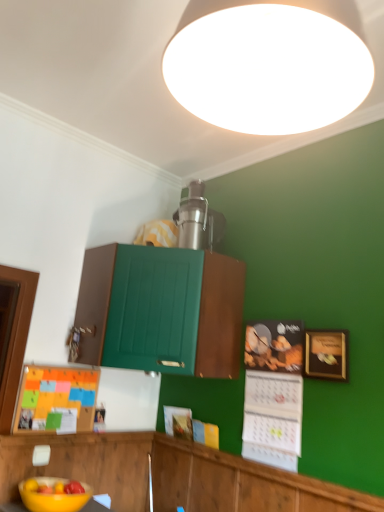
Question: Visually, is white matte ceiling light at upper center positioned to the left or to the right of yellow matte bowl at lower left?

Choices:
 (A) left
 (B) right

Answer: (B)

Question: Considering the positions of white matte ceiling light at upper center and yellow matte bowl at lower left in the image, is white matte ceiling light at upper center taller or shorter than yellow matte bowl at lower left?

Choices:
 (A) tall
 (B) short

Answer: (A)

Question: Which object is positioned farthest from the green matte cabinet at center, placed as the 2th cabinetry when sorted from bottom to top?

Choices:
 (A) matte black calendar at lower right, acting as the 1th bulletin board starting from the right
 (B) yellow matte bowl at lower left
 (C) burlap bulletin board at lower left, the 2th bulletin board positioned from the right
 (D) gold-framed picture at right
 (E) white matte ceiling light at upper center

Answer: (E)

Question: Which object is the closest to the matte black calendar at lower right, the second bulletin board viewed from the left?

Choices:
 (A) wooden cabinet at lower center, placed as the 2th cabinetry when sorted from top to bottom
 (B) white matte ceiling light at upper center
 (C) burlap bulletin board at lower left, the 2th bulletin board positioned from the right
 (D) yellow matte bowl at lower left
 (E) green matte cabinet at center, arranged as the 1th cabinetry when viewed from the top

Answer: (A)